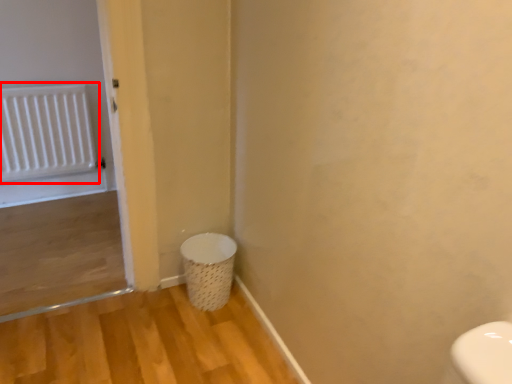
Question: From the image, what is the correct spatial relationship of radiator (annotated by the red box) in relation to laundry basket?

Choices:
 (A) left
 (B) right

Answer: (A)